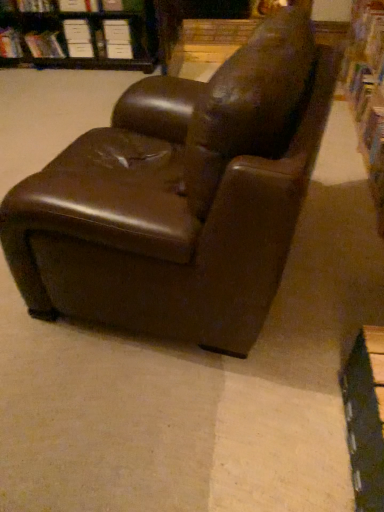
Question: Is white paper at upper center, which is counted as the 4th paperback book, starting from the left, taller than brown leather bookcase at upper left?

Choices:
 (A) no
 (B) yes

Answer: (A)

Question: Is white paper at upper center, which is the first paperback book from right to left, surrounding brown leather bookcase at upper left?

Choices:
 (A) yes
 (B) no

Answer: (B)

Question: From a real-world perspective, is white paper at upper center, which is the first paperback book from right to left, on brown leather bookcase at upper left?

Choices:
 (A) yes
 (B) no

Answer: (B)

Question: Considering the relative positions of white paper at upper center, which is counted as the 4th paperback book, starting from the left, and brown leather bookcase at upper left in the image provided, is white paper at upper center, which is counted as the 4th paperback book, starting from the left, behind brown leather bookcase at upper left?

Choices:
 (A) no
 (B) yes

Answer: (B)

Question: Can you confirm if white paper at upper center, which is the first paperback book from right to left, is thinner than brown leather bookcase at upper left?

Choices:
 (A) yes
 (B) no

Answer: (A)

Question: Considering the relative sizes of white paper at upper center, which is counted as the 4th paperback book, starting from the left, and brown leather bookcase at upper left in the image provided, is white paper at upper center, which is counted as the 4th paperback book, starting from the left, bigger than brown leather bookcase at upper left?

Choices:
 (A) no
 (B) yes

Answer: (A)

Question: Does white paper at upper center, which is the first paperback book from right to left, have a greater height compared to brown leather chair at center?

Choices:
 (A) no
 (B) yes

Answer: (A)

Question: Does white paper at upper center, which is counted as the 4th paperback book, starting from the left, touch brown leather chair at center?

Choices:
 (A) yes
 (B) no

Answer: (B)

Question: Does white paper at upper center, which is the first paperback book from right to left, lie behind brown leather chair at center?

Choices:
 (A) yes
 (B) no

Answer: (A)

Question: Can you confirm if white paper at upper center, which is the first paperback book from right to left, is positioned to the left of brown leather chair at center?

Choices:
 (A) yes
 (B) no

Answer: (A)

Question: From a real-world perspective, is white paper at upper center, which is counted as the 4th paperback book, starting from the left, beneath brown leather chair at center?

Choices:
 (A) yes
 (B) no

Answer: (A)

Question: Does white paper at upper center, which is counted as the 4th paperback book, starting from the left, have a smaller size compared to brown leather chair at center?

Choices:
 (A) yes
 (B) no

Answer: (A)

Question: Is hardcover book at upper left, marked as the second book in a right-to-left arrangement, to the right of white paper at upper center, which is the first paperback book from right to left, from the viewer's perspective?

Choices:
 (A) yes
 (B) no

Answer: (B)